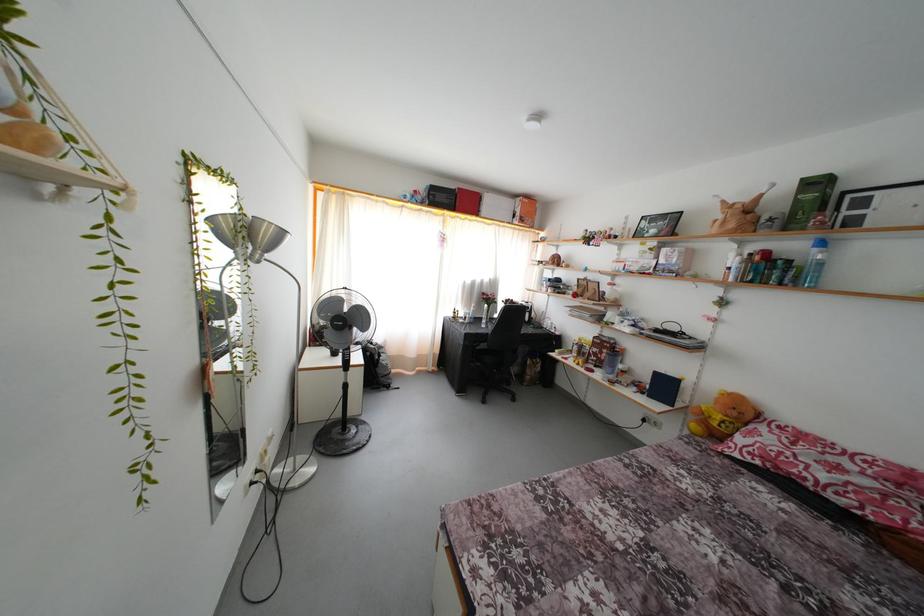
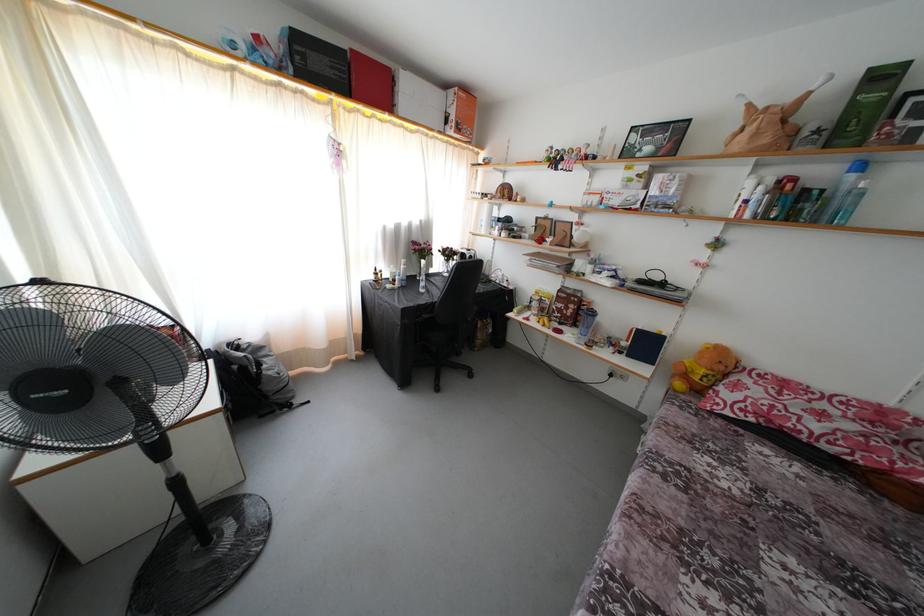
Where in the second image is the point corresponding to pixel 463 207 from the first image?

(359, 83)